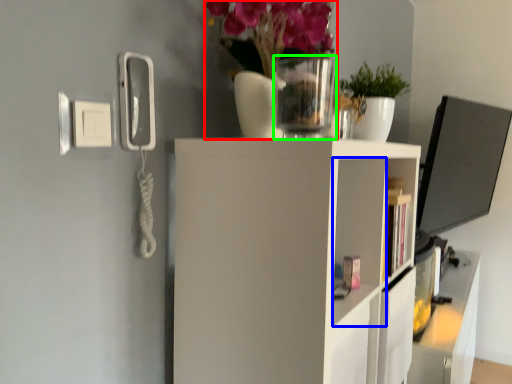
Question: Based on their relative distances, which object is farther from floral arrangement (highlighted by a red box)? Choose from cabinet (highlighted by a blue box) and glass vase (highlighted by a green box).

Choices:
 (A) cabinet
 (B) glass vase

Answer: (A)